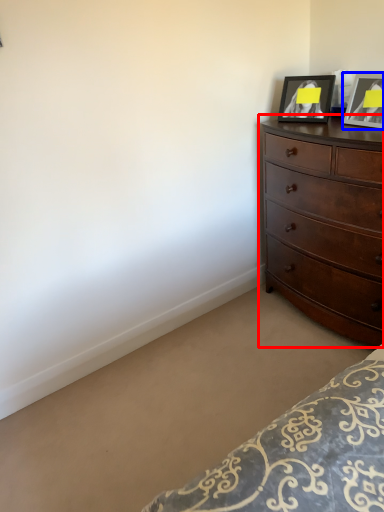
Question: Which point is further to the camera, chest of drawers (highlighted by a red box) or picture frame (highlighted by a blue box)?

Choices:
 (A) chest of drawers
 (B) picture frame

Answer: (B)